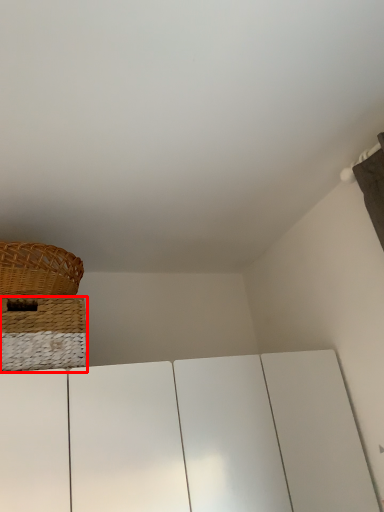
Question: Where is basket (annotated by the red box) located in relation to picnic basket in the image?

Choices:
 (A) right
 (B) left

Answer: (A)